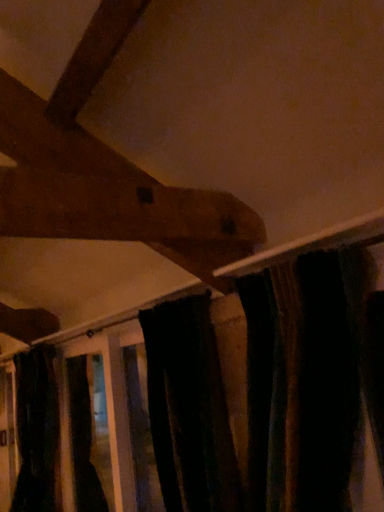
Question: Should I look upward or downward to see velvet dark green curtain at lower left?

Choices:
 (A) up
 (B) down

Answer: (B)